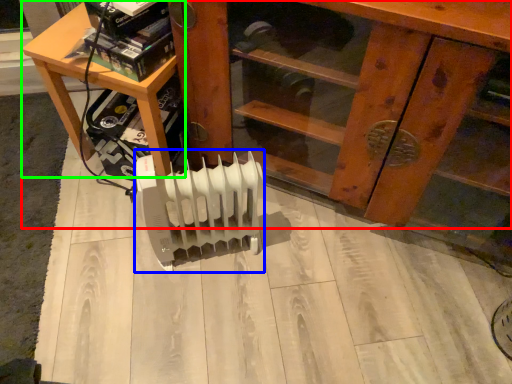
Question: Which object is the closest to the furniture (highlighted by a red box)? Choose among these: heater (highlighted by a blue box) or table (highlighted by a green box).

Choices:
 (A) heater
 (B) table

Answer: (B)